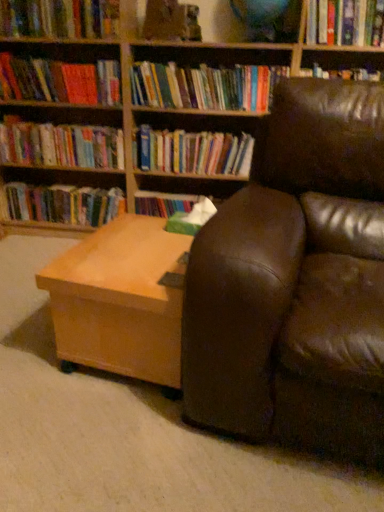
This screenshot has width=384, height=512. I want to click on vacant area on top of light brown wood table at lower left (from a real-world perspective), so (x=140, y=250).